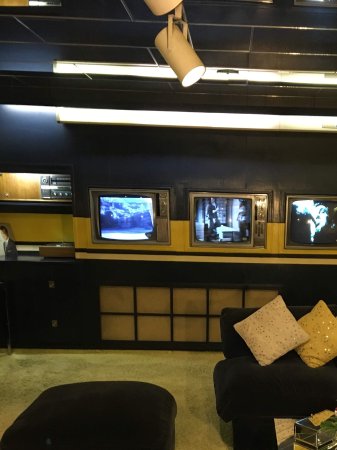
Where is `stereo`? stereo is located at coordinates (57, 185).